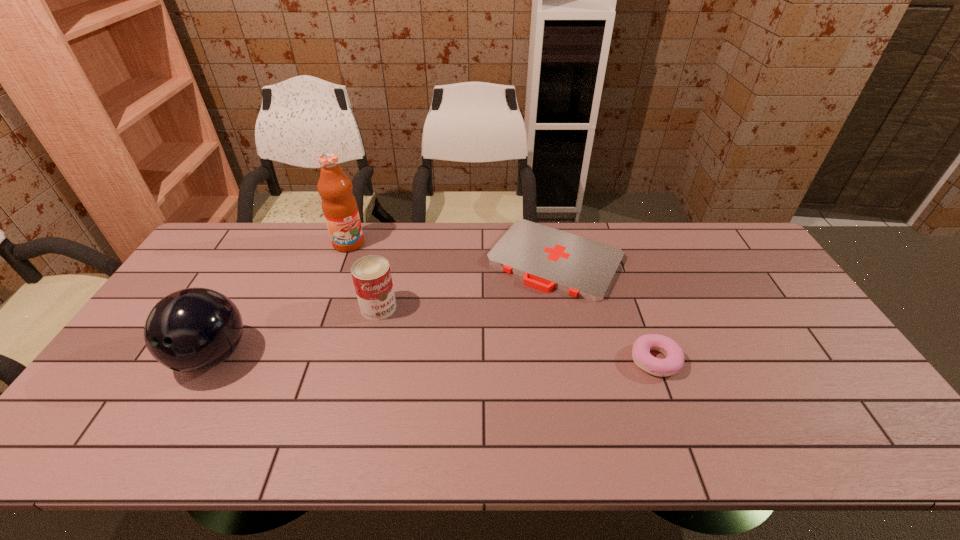
This screenshot has width=960, height=540. Identify the location of the leftmost object. pos(194,329).

Identify the location of the fourth shortest object. This screenshot has width=960, height=540. (194, 329).

Identify the location of the fourth tallest object. The height and width of the screenshot is (540, 960). (674, 361).

You are a GUI agent. You are given a task and a screenshot of the screen. Output one action in this format:
    pyautogui.click(x=<x>, y=<y>)
    Task: Click on the shortest object
    Image resolution: width=960 pixels, height=540 pixels.
    Given the screenshot: What is the action you would take?
    pyautogui.click(x=548, y=258)

Where is `fruit juice`? fruit juice is located at coordinates (339, 206).

The height and width of the screenshot is (540, 960). I want to click on the second object from left to right, so click(339, 206).

Locate an element on the screen. This screenshot has width=960, height=540. the third shortest object is located at coordinates (371, 274).

Image resolution: width=960 pixels, height=540 pixels. I want to click on the third object from right to left, so point(371,274).

Where is `free space located 0.060m on the side of the second tallest object with the finger holes`? The height and width of the screenshot is (540, 960). free space located 0.060m on the side of the second tallest object with the finger holes is located at coordinates click(x=181, y=411).

Where is `free space located 0.210m on the right of the pastry`? This screenshot has height=540, width=960. free space located 0.210m on the right of the pastry is located at coordinates (x=760, y=360).